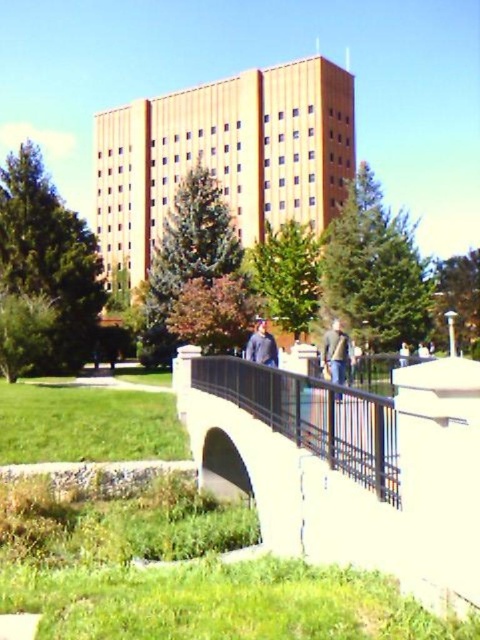
You are a delivery person trying to pass under the white concrete pedestrian bridge at center while carrying a large box. The box is as tall as the denim jacket at center. Will the box fit under the bridge?

The white concrete pedestrian bridge at center has a greater height compared to the denim jacket at center. Since the box is as tall as the denim jacket, it will fit under the bridge.

You are standing at the center of the bridge and want to reach the black metal rail at center. Which direction should you move to reach it?

The black metal rail at center is already at your current position since you are standing at the center of the bridge.

You are a maintenance worker needing to reach the denim jacket at center from the white concrete pedestrian bridge at center. Can you walk directly to it without any obstacles? Please explain your reasoning based on the distance between them.

The white concrete pedestrian bridge at center and denim jacket at center are 2.44 meters apart. Since there are no mentioned obstacles between them, you can walk directly to the denim jacket at center from the white concrete pedestrian bridge at center.